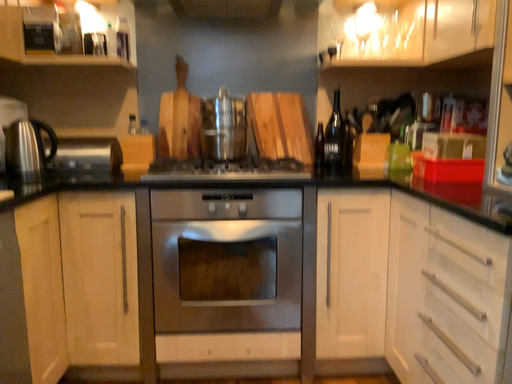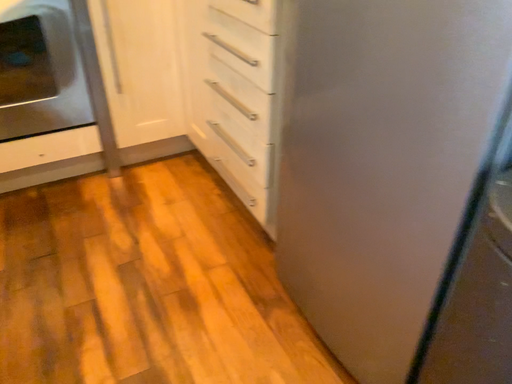
Question: How did the camera likely rotate when shooting the video?

Choices:
 (A) rotated left
 (B) rotated right

Answer: (B)